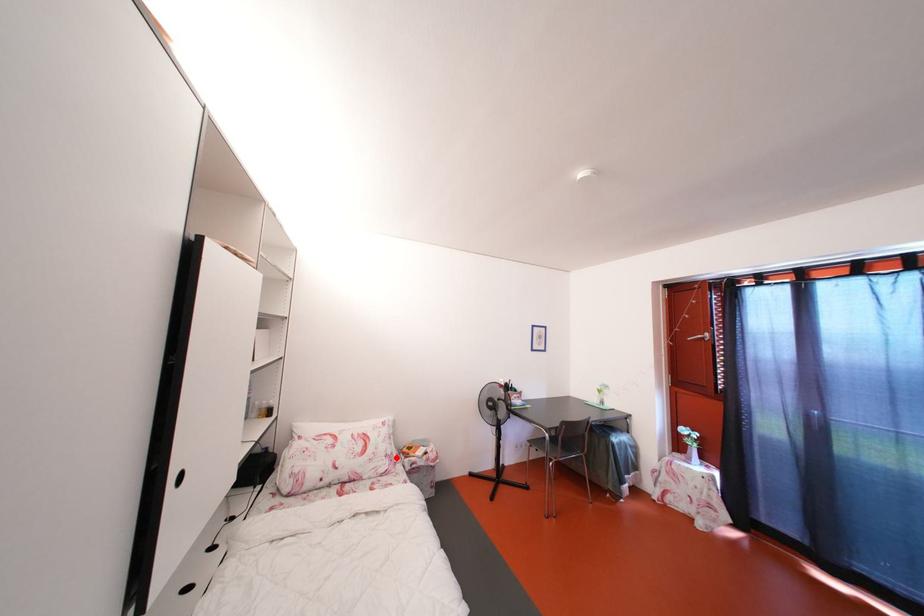
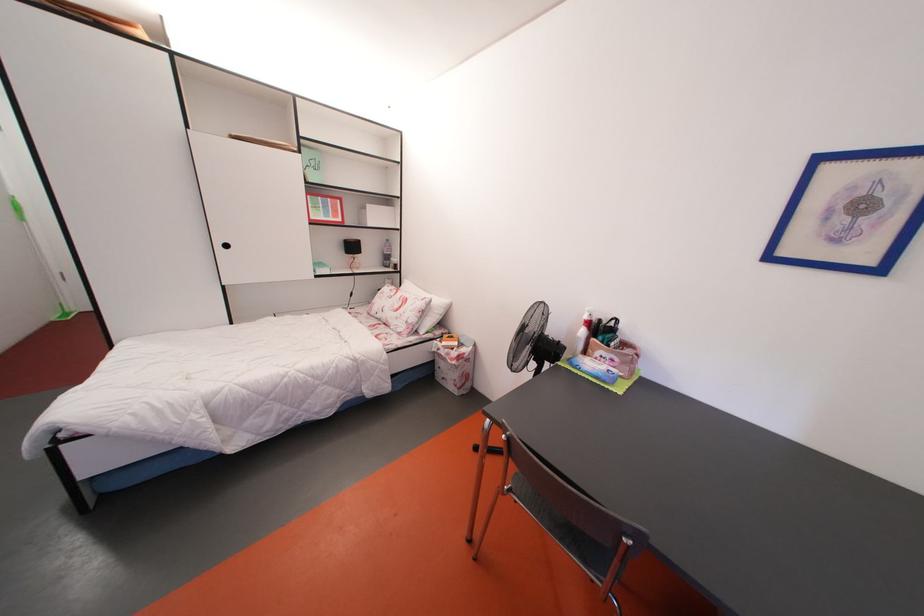
Question: A red point is marked in image1. In image2, is the corresponding 3D point closer to the camera or farther? Reply with the corresponding letter.

Choices:
 (A) The corresponding 3D point is closer.
 (B) The corresponding 3D point is farther.

Answer: (B)